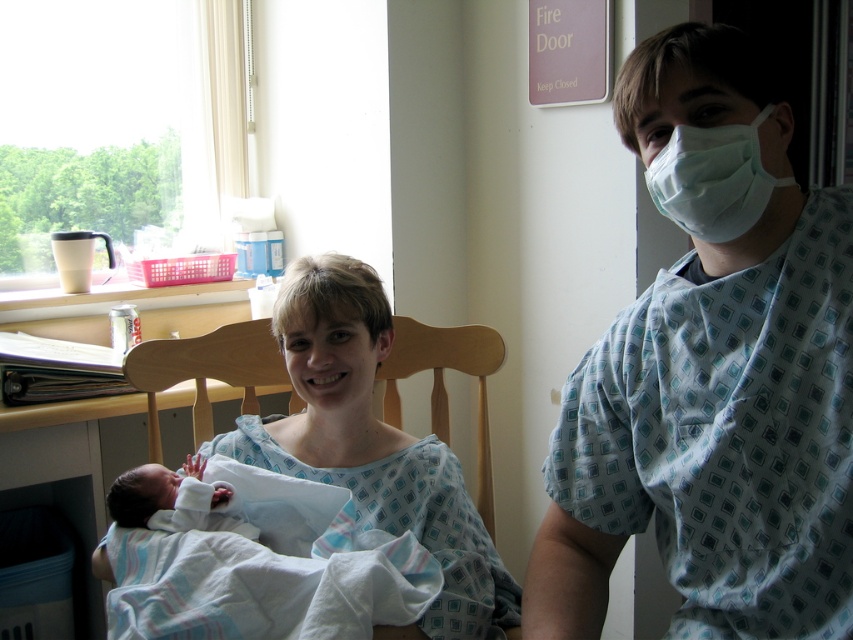
You are a nurse in the hospital room and need to check the size of the light blue printed scrubs at right and the white medical mask at upper right. Which one is wider?

The light blue printed scrubs at right is wider than the white medical mask at upper right.

You are a nurse in the hospital room. You need to place a small medical kit on the wooden chair at center. The coordinates provided are point (206, 371). Can you confirm if this point corresponds to the wooden chair at center?

Yes, the point (206, 371) corresponds to the wooden chair at center as per the coordinates provided.

You are a nurse in a hospital room. You need to locate the light blue printed scrubs at right and the white medical mask at upper right. Which object is higher up in the image?

The light blue printed scrubs at right is taller than white medical mask at upper right, so the light blue printed scrubs at right is higher up in the image.